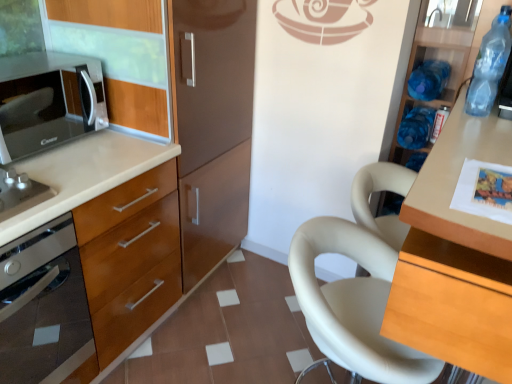
Question: Is black glossy microwave at left wider than blue plastic bottle at right, the third bottle when ordered from front to back?

Choices:
 (A) no
 (B) yes

Answer: (B)

Question: Could you tell me if black glossy microwave at left is facing blue plastic bottle at right, the third bottle when ordered from front to back?

Choices:
 (A) yes
 (B) no

Answer: (B)

Question: From the image's perspective, is black glossy microwave at left on top of blue plastic bottle at right, the first bottle when ordered from back to front?

Choices:
 (A) no
 (B) yes

Answer: (B)

Question: Does black glossy microwave at left touch blue plastic bottle at right, the first bottle when ordered from back to front?

Choices:
 (A) yes
 (B) no

Answer: (B)

Question: Does black glossy microwave at left have a larger size compared to blue plastic bottle at right, the third bottle when ordered from front to back?

Choices:
 (A) no
 (B) yes

Answer: (B)

Question: Can you confirm if black glossy microwave at left is taller than blue plastic bottle at right, the first bottle when ordered from back to front?

Choices:
 (A) no
 (B) yes

Answer: (B)

Question: Is blue plastic bottle at upper right, which ranks as the second bottle in back-to-front order, not within blue translucent bottle at upper right, which is the 3th bottle in back-to-front order?

Choices:
 (A) no
 (B) yes

Answer: (B)

Question: Can you confirm if blue plastic bottle at upper right, which ranks as the second bottle in back-to-front order, is shorter than blue translucent bottle at upper right, placed as the first bottle when sorted from front to back?

Choices:
 (A) yes
 (B) no

Answer: (A)

Question: Is blue plastic bottle at upper right, which ranks as the second bottle in back-to-front order, bigger than blue translucent bottle at upper right, placed as the first bottle when sorted from front to back?

Choices:
 (A) no
 (B) yes

Answer: (B)

Question: From the image's perspective, does blue plastic bottle at upper right, which ranks as the second bottle in back-to-front order, appear lower than blue translucent bottle at upper right, placed as the first bottle when sorted from front to back?

Choices:
 (A) yes
 (B) no

Answer: (B)

Question: Considering the relative sizes of blue plastic bottle at upper right, which ranks as the second bottle in back-to-front order, and blue translucent bottle at upper right, which is the 3th bottle in back-to-front order, in the image provided, is blue plastic bottle at upper right, which ranks as the second bottle in back-to-front order, taller than blue translucent bottle at upper right, which is the 3th bottle in back-to-front order,?

Choices:
 (A) no
 (B) yes

Answer: (A)

Question: Is blue translucent bottle at upper right, placed as the first bottle when sorted from front to back, located within blue plastic bottle at upper right, the 2th bottle from the front?

Choices:
 (A) yes
 (B) no

Answer: (B)

Question: From the image's perspective, is blue plastic bottle at upper right, the 2th bottle from the front, above satin silver oven at left?

Choices:
 (A) no
 (B) yes

Answer: (B)